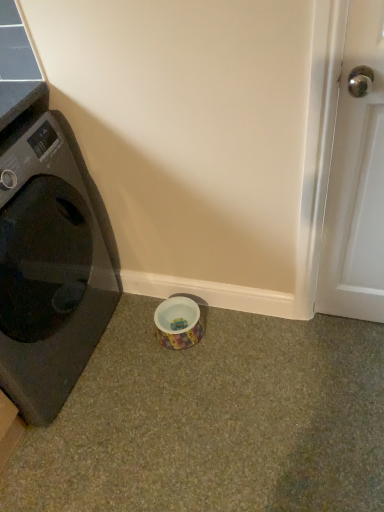
Question: Does white glossy door handle at right have a greater width compared to black glossy washing machine at left?

Choices:
 (A) yes
 (B) no

Answer: (B)

Question: Would you say white glossy door handle at right is a long distance from black glossy washing machine at left?

Choices:
 (A) no
 (B) yes

Answer: (A)

Question: From the image's perspective, is white glossy door handle at right located beneath black glossy washing machine at left?

Choices:
 (A) no
 (B) yes

Answer: (A)

Question: Can you confirm if white glossy door handle at right is shorter than black glossy washing machine at left?

Choices:
 (A) no
 (B) yes

Answer: (A)

Question: Can you confirm if white glossy door handle at right is smaller than black glossy washing machine at left?

Choices:
 (A) yes
 (B) no

Answer: (A)

Question: In the image, is white glossy door handle at right positioned in front of or behind multicolored ceramic bowl at lower center?

Choices:
 (A) front
 (B) behind

Answer: (A)

Question: Is point (375, 13) positioned closer to the camera than point (193, 329)?

Choices:
 (A) farther
 (B) closer

Answer: (B)

Question: From a real-world perspective, relative to multicolored ceramic bowl at lower center, is white glossy door handle at right vertically above or below?

Choices:
 (A) below
 (B) above

Answer: (B)

Question: In terms of height, does white glossy door handle at right look taller or shorter compared to multicolored ceramic bowl at lower center?

Choices:
 (A) tall
 (B) short

Answer: (A)

Question: Choose the correct answer: Is white glossy door handle at right inside black glossy washing machine at left or outside it?

Choices:
 (A) inside
 (B) outside

Answer: (B)

Question: In terms of height, does white glossy door handle at right look taller or shorter compared to black glossy washing machine at left?

Choices:
 (A) tall
 (B) short

Answer: (A)

Question: Considering their positions, is white glossy door handle at right located in front of or behind black glossy washing machine at left?

Choices:
 (A) front
 (B) behind

Answer: (A)

Question: Considering the positions of white glossy door handle at right and black glossy washing machine at left in the image, is white glossy door handle at right wider or thinner than black glossy washing machine at left?

Choices:
 (A) wide
 (B) thin

Answer: (B)

Question: From a real-world perspective, is multicolored ceramic bowl at lower center positioned above or below white glossy door handle at right?

Choices:
 (A) below
 (B) above

Answer: (A)

Question: In terms of size, does multicolored ceramic bowl at lower center appear bigger or smaller than white glossy door handle at right?

Choices:
 (A) big
 (B) small

Answer: (B)